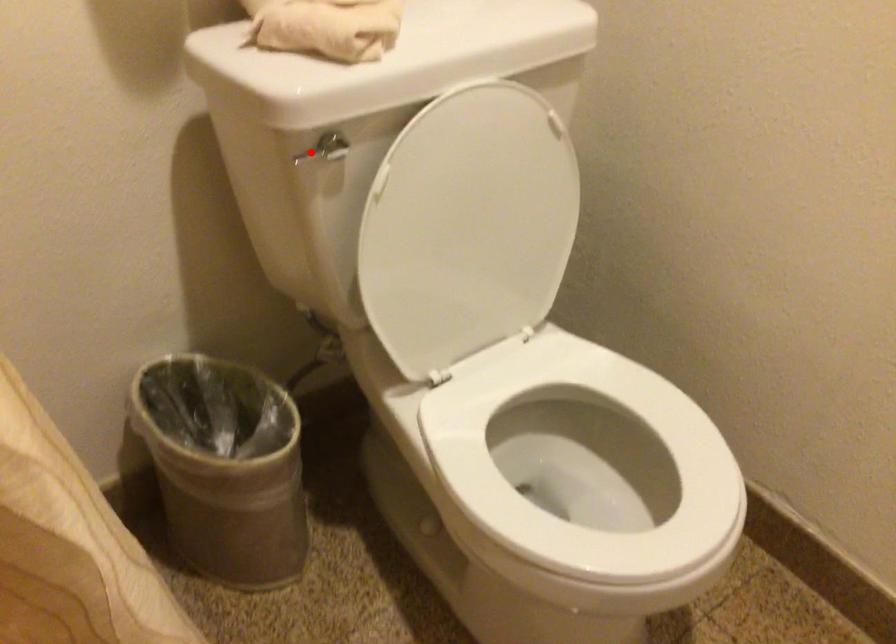
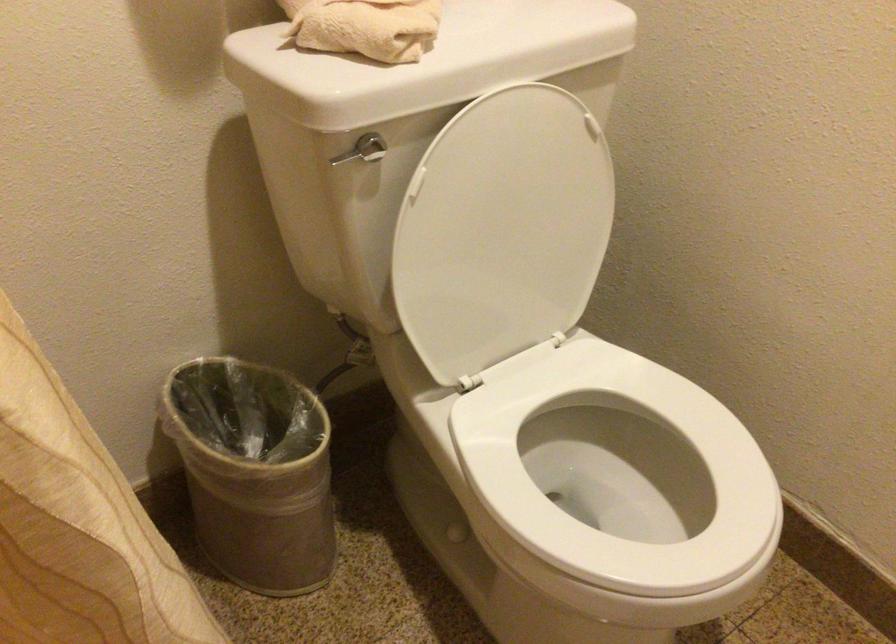
Locate, in the second image, the point that corresponds to the highlighted location in the first image.

(348, 155)